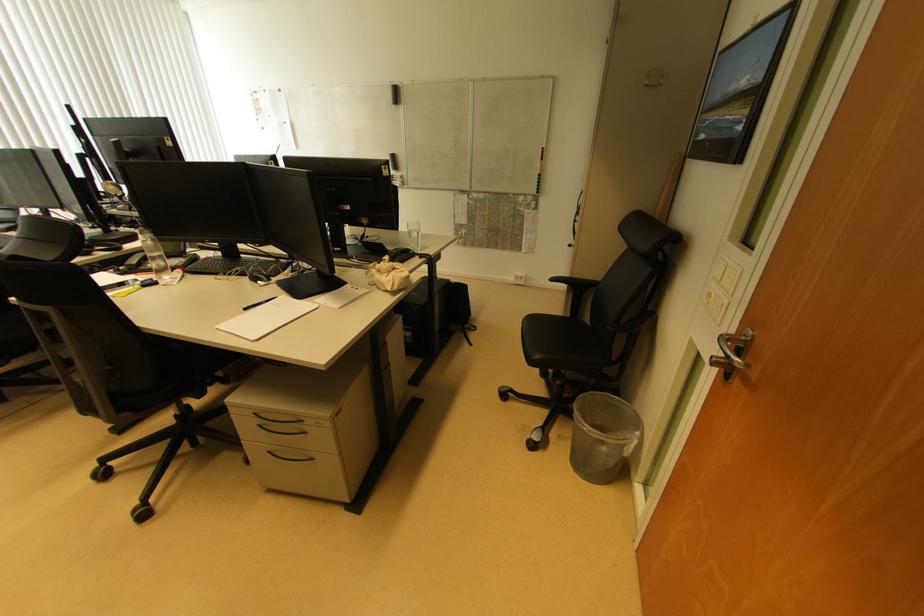
This screenshot has height=616, width=924. I want to click on metal door handle, so click(732, 352).